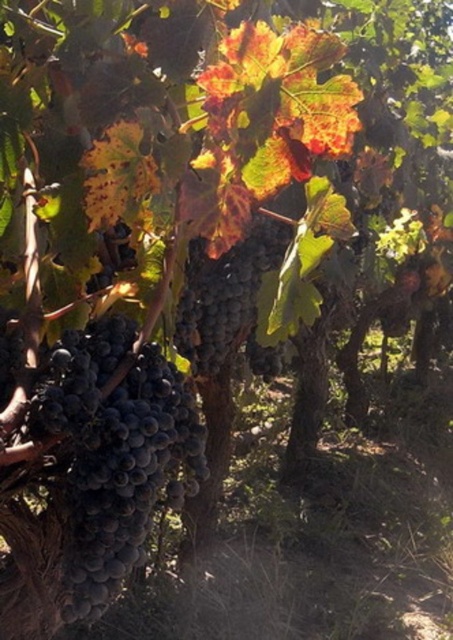
Measure the distance between shiny dark purple grapes at center-left and camera.

The distance of shiny dark purple grapes at center-left from camera is 1.17 meters.

Does shiny dark purple grapes at center-left come behind shiny dark purple grapes at center?

No, shiny dark purple grapes at center-left is in front of shiny dark purple grapes at center.

Who is more distant from viewer, (72, 340) or (213, 342)?

Positioned behind is point (213, 342).

At what (x,y) coordinates should I click in order to perform the action: click on shiny dark purple grapes at center-left. Please return your answer as a coordinate pair (x, y). The width and height of the screenshot is (453, 640). Looking at the image, I should click on click(x=115, y=456).